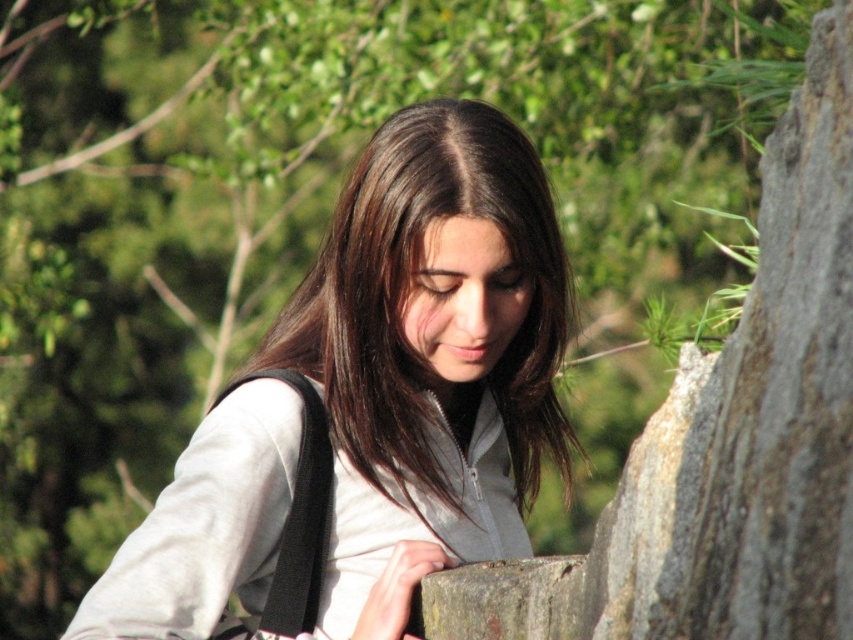
The width and height of the screenshot is (853, 640). I want to click on white matte jacket at center, so click(x=372, y=404).

Between white matte jacket at center and black fabric shoulder bag at lower left, which one appears on the left side from the viewer's perspective?

From the viewer's perspective, black fabric shoulder bag at lower left appears more on the left side.

Which is behind, point (366, 605) or point (287, 600)?

Positioned behind is point (366, 605).

At what (x,y) coordinates should I click in order to perform the action: click on white matte jacket at center. Please return your answer as a coordinate pair (x, y). The width and height of the screenshot is (853, 640). Looking at the image, I should click on (372, 404).

Which is behind, point (677, 588) or point (320, 580)?

Point (320, 580)

Is point (630, 529) positioned in front of point (312, 547)?

Yes, point (630, 529) is in front of point (312, 547).

Locate an element on the screen. This screenshot has width=853, height=640. gray rough stone at center is located at coordinates (726, 438).

Does white matte jacket at center appear on the left side of gray rough stone at center?

Yes, white matte jacket at center is to the left of gray rough stone at center.

What do you see at coordinates (372, 404) in the screenshot?
I see `white matte jacket at center` at bounding box center [372, 404].

Locate an element on the screen. white matte jacket at center is located at coordinates (372, 404).